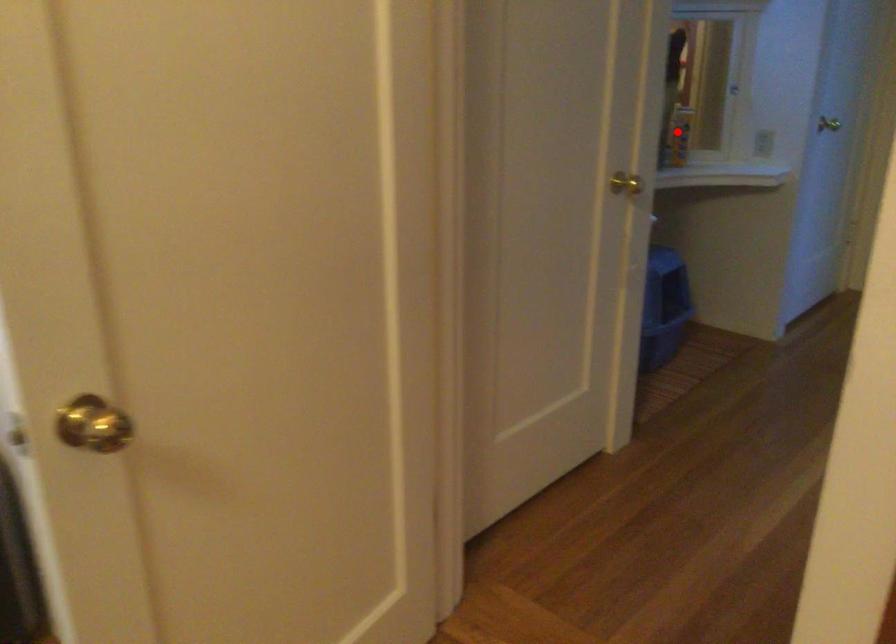
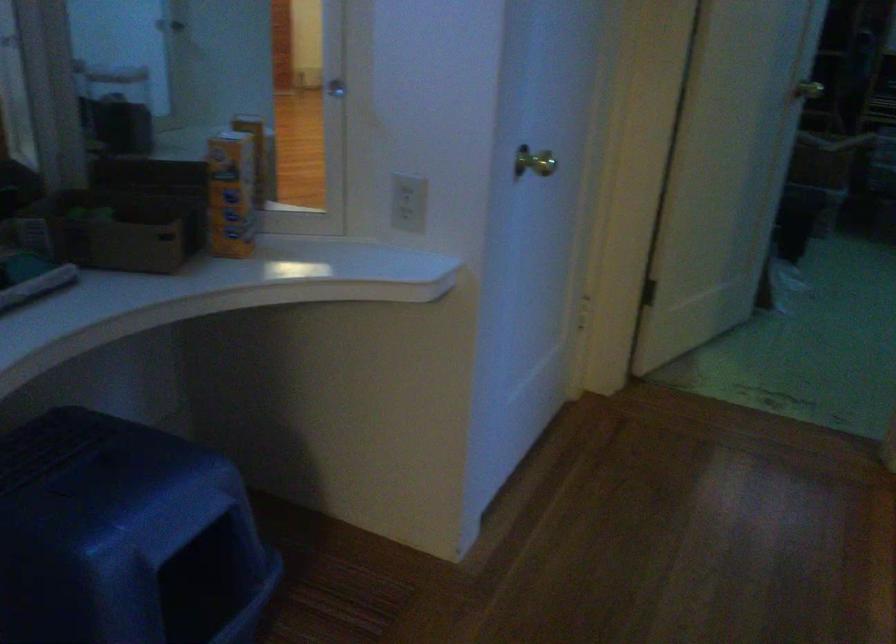
The point at the highlighted location is marked in the first image. Where is the corresponding point in the second image?

(230, 194)